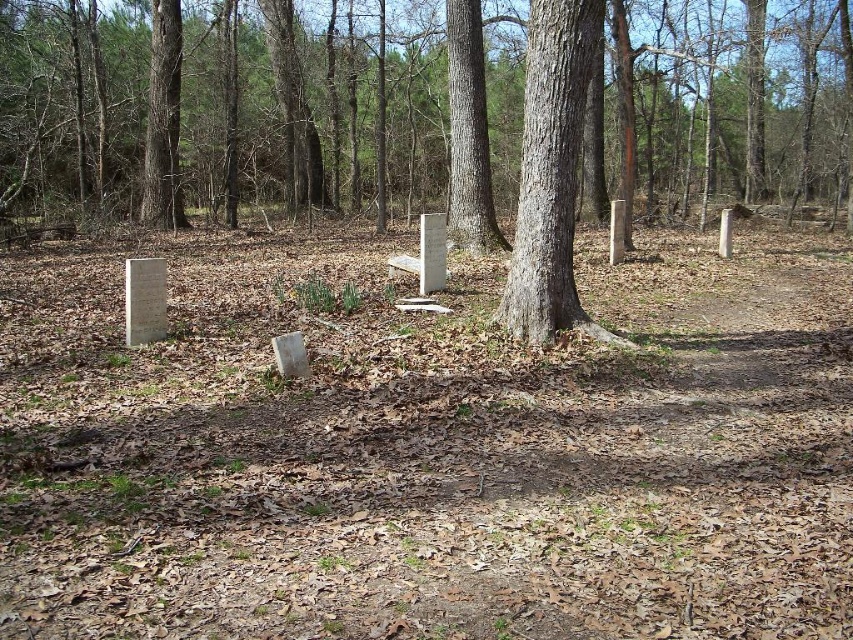
Question: Is smooth gray tree trunk at center wider than brown rough bark tree at center?

Choices:
 (A) no
 (B) yes

Answer: (B)

Question: Which object appears farthest from the camera in this image?

Choices:
 (A) smooth bark tree at center
 (B) smooth gray tree trunk at center
 (C) smooth concrete markers at center
 (D) brown rough bark tree at center

Answer: (A)

Question: Which point appears closest to the camera in this image?

Choices:
 (A) (474, 218)
 (B) (543, 99)
 (C) (36, 44)
 (D) (167, 56)

Answer: (B)

Question: Is smooth concrete markers at center thinner than smooth gray tree trunk at center?

Choices:
 (A) no
 (B) yes

Answer: (A)

Question: Is brown rough bark tree at center positioned behind smooth bark tree at center?

Choices:
 (A) no
 (B) yes

Answer: (A)

Question: Among these objects, which one is nearest to the camera?

Choices:
 (A) smooth gray tree trunk at center
 (B) smooth bark tree at center
 (C) brown rough bark tree at center

Answer: (A)